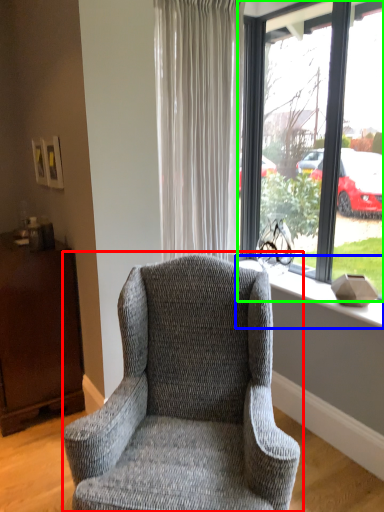
Question: Considering the real-world distances, which object is farthest from chair (highlighted by a red box)? window sill (highlighted by a blue box) or window (highlighted by a green box)?

Choices:
 (A) window sill
 (B) window

Answer: (B)